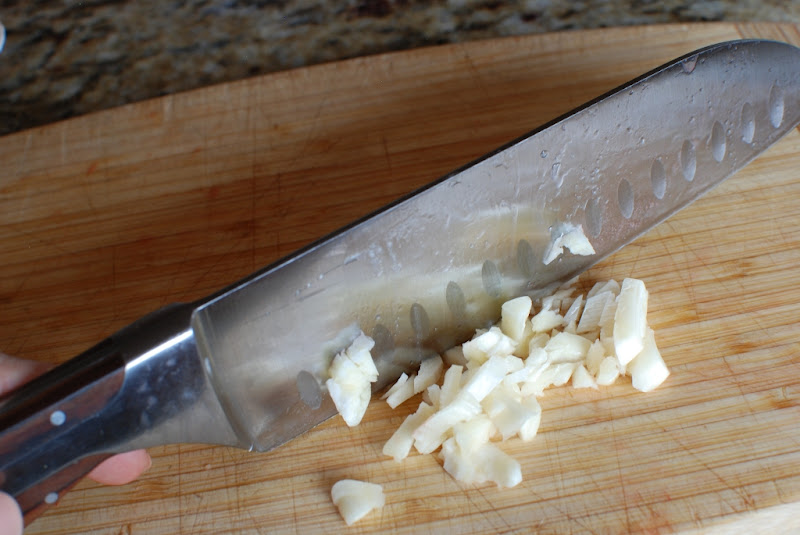
Locate an element on the screen. The width and height of the screenshot is (800, 535). knife handle is located at coordinates (90, 402).